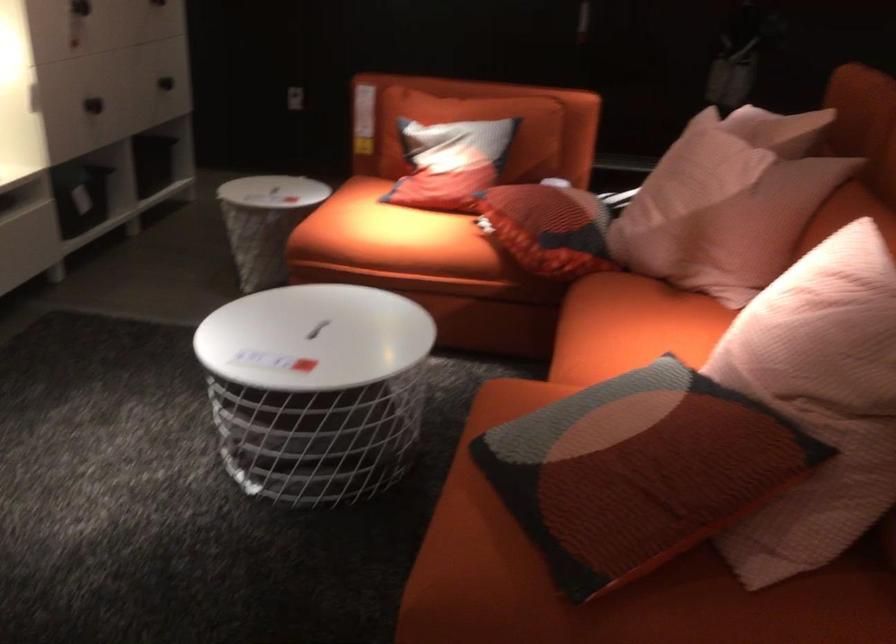
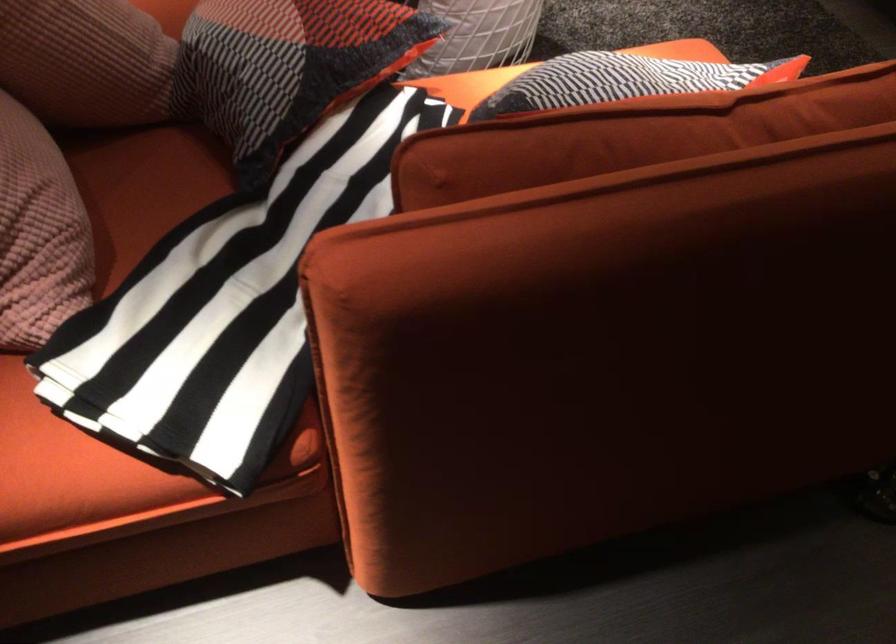
The point at (x=656, y=192) is marked in the first image. Where is the corresponding point in the second image?

(85, 61)